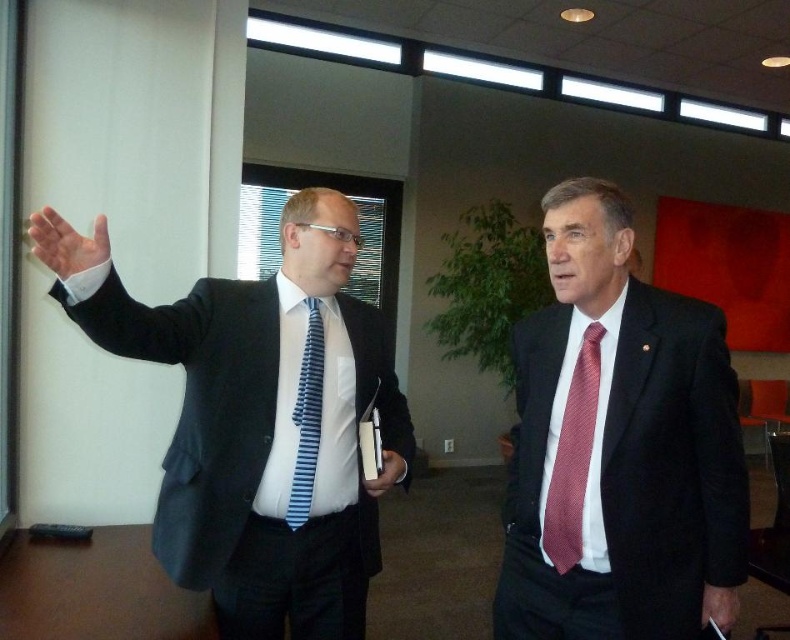
Looking at this image, does matte black suit at left appear on the right side of white matte hand at upper left?

Indeed, matte black suit at left is positioned on the right side of white matte hand at upper left.

Who is more forward, (196, 321) or (74, 257)?

Positioned in front is point (74, 257).

Which is behind, point (232, 436) or point (32, 253)?

The point (32, 253) is behind.

At what (x,y) coordinates should I click in order to perform the action: click on matte black suit at left. Please return your answer as a coordinate pair (x, y). Image resolution: width=790 pixels, height=640 pixels. Looking at the image, I should click on (266, 426).

Find the location of a particular element. blue striped tie at center is located at coordinates click(307, 417).

Is matte black suit at left thinner than red textured tie at right?

In fact, matte black suit at left might be wider than red textured tie at right.

Does matte black suit at left have a lesser height compared to red textured tie at right?

No, matte black suit at left is not shorter than red textured tie at right.

Image resolution: width=790 pixels, height=640 pixels. I want to click on matte black suit at left, so click(x=266, y=426).

Where is `matte black suit at left`? The image size is (790, 640). matte black suit at left is located at coordinates (266, 426).